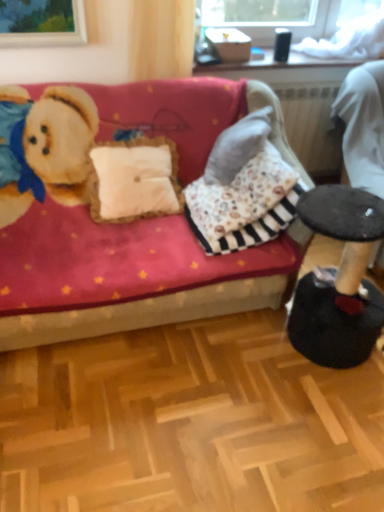
Question: In terms of height, does dark brown leather swivel chair at right look taller or shorter compared to velvet red couch at center?

Choices:
 (A) tall
 (B) short

Answer: (A)

Question: Considering the positions of dark brown leather swivel chair at right and velvet red couch at center in the image, is dark brown leather swivel chair at right wider or thinner than velvet red couch at center?

Choices:
 (A) thin
 (B) wide

Answer: (A)

Question: From a real-world perspective, is dark brown leather swivel chair at right above or below velvet red couch at center?

Choices:
 (A) above
 (B) below

Answer: (A)

Question: Would you say velvet red couch at center is inside or outside dark brown leather swivel chair at right?

Choices:
 (A) inside
 (B) outside

Answer: (B)

Question: From a real-world perspective, relative to dark brown leather swivel chair at right, is velvet red couch at center vertically above or below?

Choices:
 (A) below
 (B) above

Answer: (A)

Question: In terms of width, does velvet red couch at center look wider or thinner when compared to dark brown leather swivel chair at right?

Choices:
 (A) wide
 (B) thin

Answer: (A)

Question: Considering the positions of point (140, 309) and point (369, 172), is point (140, 309) closer or farther from the camera than point (369, 172)?

Choices:
 (A) closer
 (B) farther

Answer: (A)